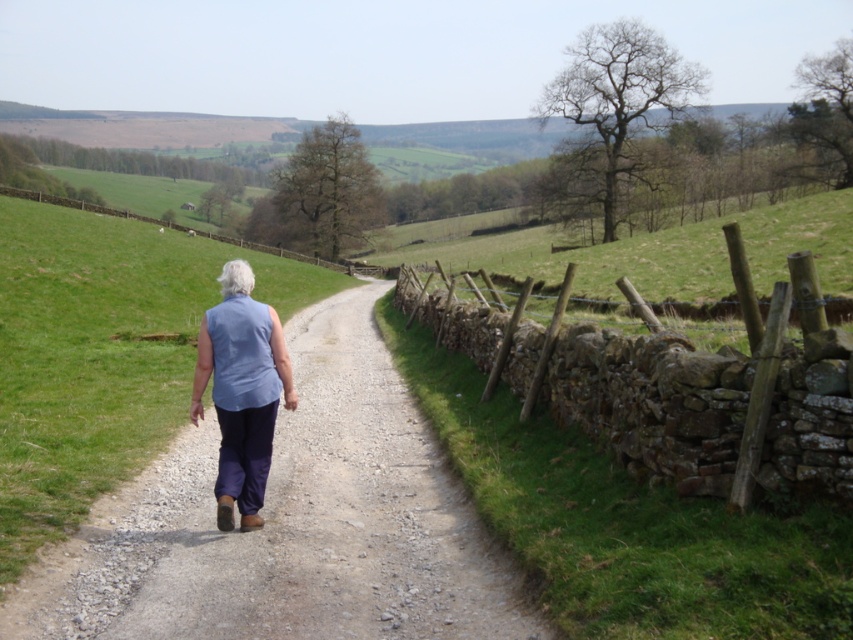
Question: Which of the following is the closest to the observer?

Choices:
 (A) (482, 605)
 (B) (234, 433)
 (C) (405, 300)

Answer: (A)

Question: Which point is closer to the camera?

Choices:
 (A) dusty gravel path at center
 (B) blue fabric at center
 (C) brown stone fence at right

Answer: (C)

Question: Can you confirm if dusty gravel path at center is positioned above blue fabric at center?

Choices:
 (A) no
 (B) yes

Answer: (A)

Question: Does dusty gravel path at center appear over brown stone fence at right?

Choices:
 (A) yes
 (B) no

Answer: (B)

Question: Which object is positioned farthest from the blue fabric at center?

Choices:
 (A) dusty gravel path at center
 (B) brown stone fence at right

Answer: (B)

Question: Is dusty gravel path at center behind blue fabric at center?

Choices:
 (A) yes
 (B) no

Answer: (B)